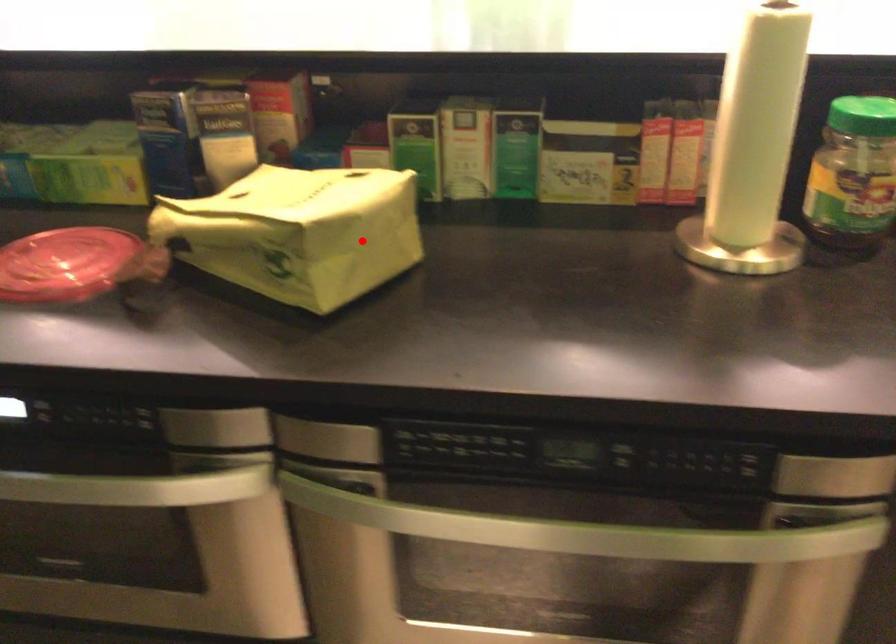
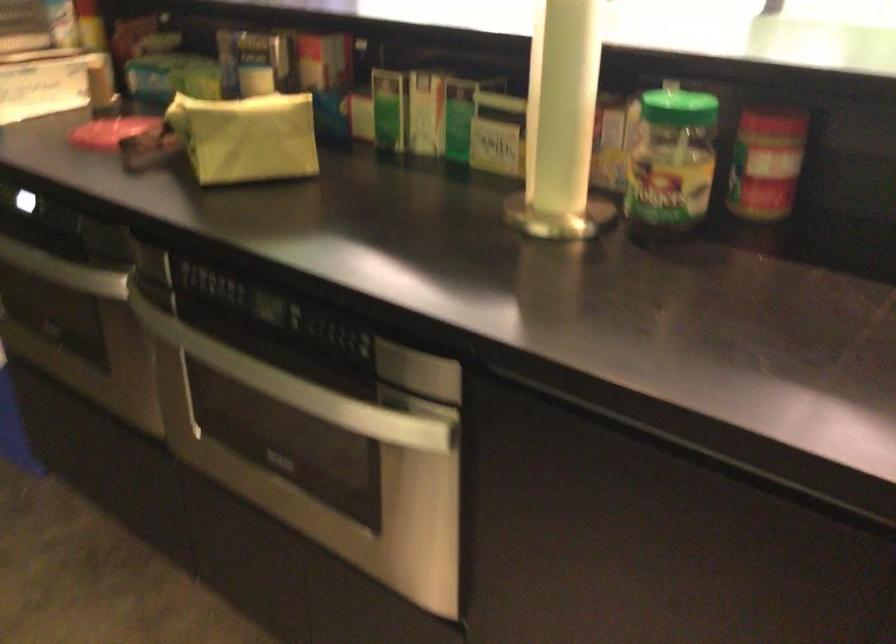
In the second image, find the point that corresponds to the highlighted location in the first image.

(246, 137)